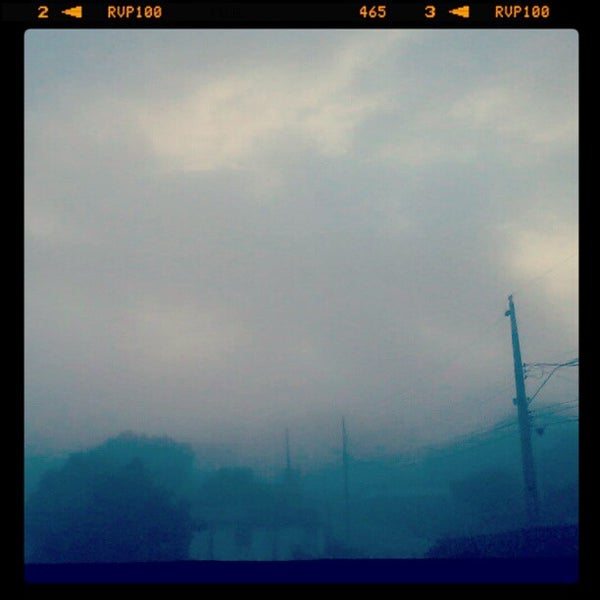
Find the location of a particular element. cable is located at coordinates (432, 370).